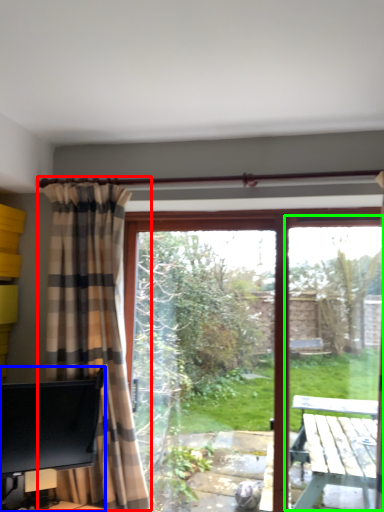
Question: Considering the real-world distances, which object is closest to curtain (highlighted by a red box)? desk (highlighted by a blue box) or screen door (highlighted by a green box).

Choices:
 (A) desk
 (B) screen door

Answer: (A)